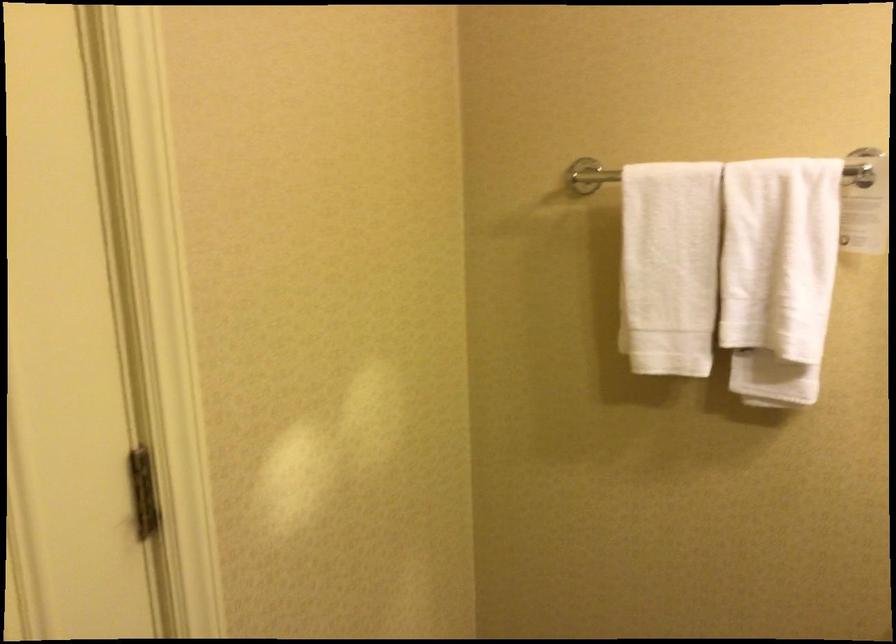
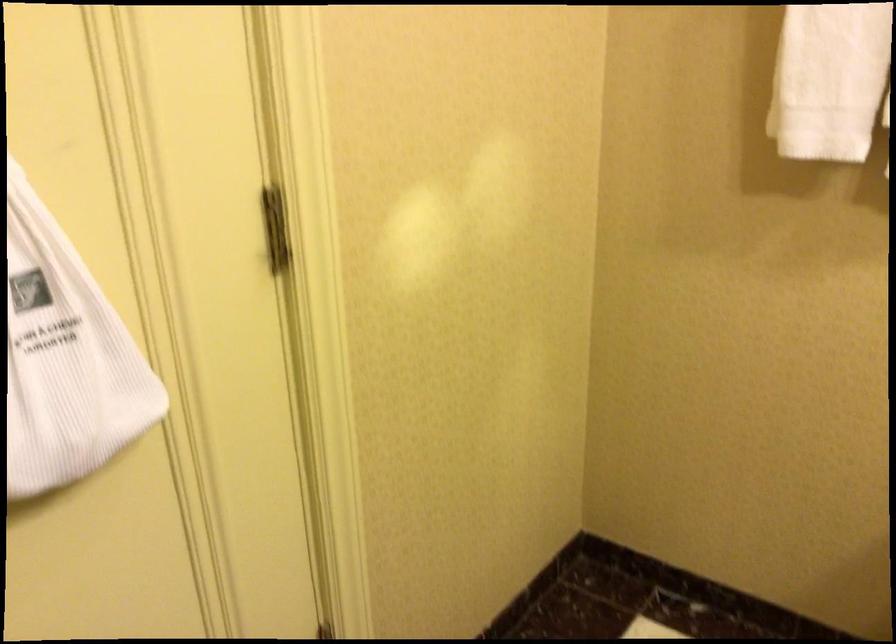
Question: The images are taken continuously from a first-person perspective. In which direction are you moving?

Choices:
 (A) Left
 (B) Right
 (C) Forward
 (D) Backward

Answer: (D)